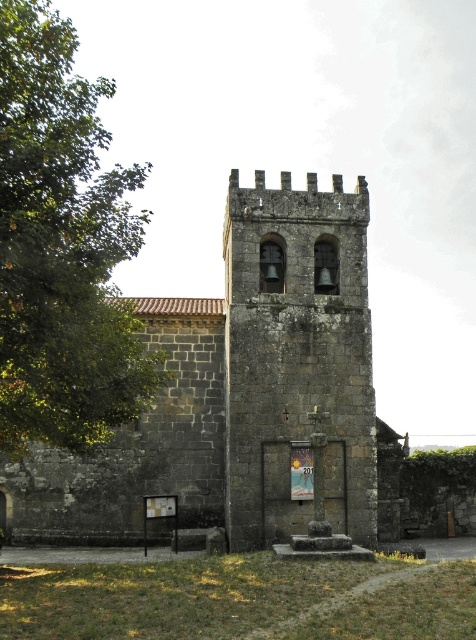
How far apart are dark gray stone church at center and green leafy tree at left?

dark gray stone church at center is 10.49 meters away from green leafy tree at left.

Is dark gray stone church at center below green leafy tree at left?

Yes, dark gray stone church at center is below green leafy tree at left.

Find the location of a particular element. dark gray stone church at center is located at coordinates (238, 392).

I want to click on dark gray stone church at center, so click(x=238, y=392).

Locate an element on the screen. Image resolution: width=476 pixels, height=640 pixels. green leafy tree at left is located at coordinates (61, 248).

Describe the element at coordinates (61, 248) in the screenshot. I see `green leafy tree at left` at that location.

The height and width of the screenshot is (640, 476). What do you see at coordinates (61, 248) in the screenshot? I see `green leafy tree at left` at bounding box center [61, 248].

I want to click on green leafy tree at left, so click(x=61, y=248).

Is dark gray stone church at center bigger than stone bell tower at center?

Indeed, dark gray stone church at center has a larger size compared to stone bell tower at center.

Is dark gray stone church at center to the right of stone bell tower at center from the viewer's perspective?

Incorrect, dark gray stone church at center is not on the right side of stone bell tower at center.

Measure the distance between dark gray stone church at center and camera.

They are 188.45 feet apart.

Identify the location of dark gray stone church at center. The width and height of the screenshot is (476, 640). (238, 392).